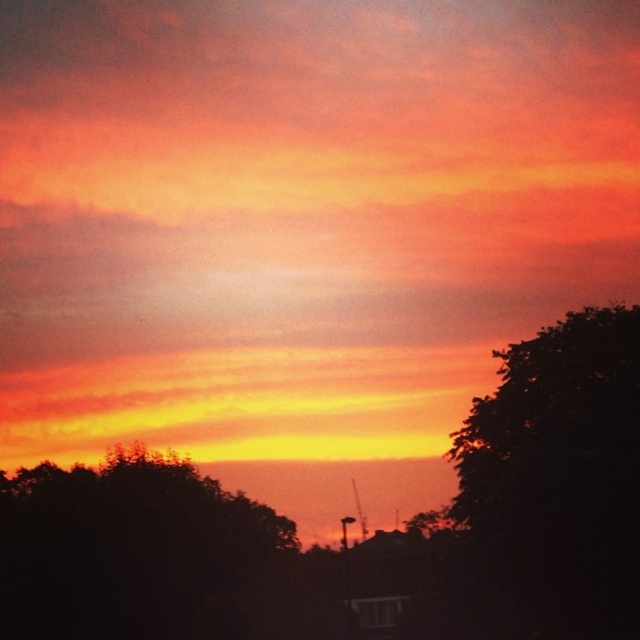
Question: Which object is farther from the camera taking this photo?

Choices:
 (A) dark green leafy tree at right
 (B) silhouette tree at lower left

Answer: (B)

Question: Does dark green leafy tree at right appear on the left side of silhouette tree at lower left?

Choices:
 (A) no
 (B) yes

Answer: (A)

Question: Is dark green leafy tree at right positioned behind silhouette tree at lower left?

Choices:
 (A) yes
 (B) no

Answer: (B)

Question: Which point appears closest to the camera in this image?

Choices:
 (A) (20, 561)
 (B) (589, 504)

Answer: (B)

Question: Where is dark green leafy tree at right located in relation to silhouette tree at lower left in the image?

Choices:
 (A) below
 (B) above

Answer: (B)